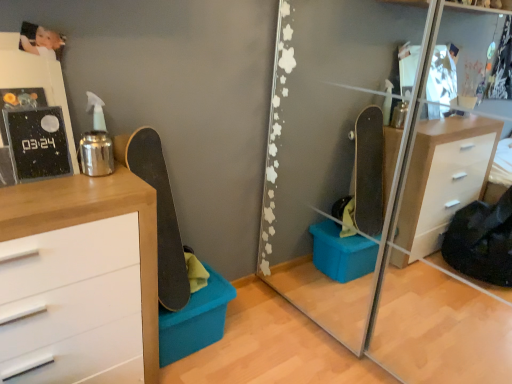
Question: Does smooth black skateboard at left contain matte blue plastic storage box at lower center?

Choices:
 (A) yes
 (B) no

Answer: (B)

Question: Is smooth black skateboard at left taller than matte blue plastic storage box at lower center?

Choices:
 (A) no
 (B) yes

Answer: (B)

Question: Considering the relative positions of smooth black skateboard at left and matte blue plastic storage box at lower center in the image provided, is smooth black skateboard at left in front of matte blue plastic storage box at lower center?

Choices:
 (A) no
 (B) yes

Answer: (B)

Question: Is smooth black skateboard at left at the right side of matte blue plastic storage box at lower center?

Choices:
 (A) yes
 (B) no

Answer: (B)

Question: Is smooth black skateboard at left next to matte blue plastic storage box at lower center?

Choices:
 (A) no
 (B) yes

Answer: (A)

Question: Is matte blue plastic storage box at lower center bigger or smaller than smooth black skateboard at left?

Choices:
 (A) small
 (B) big

Answer: (A)

Question: Do you think matte blue plastic storage box at lower center is within smooth black skateboard at left, or outside of it?

Choices:
 (A) outside
 (B) inside

Answer: (A)

Question: Is matte blue plastic storage box at lower center taller or shorter than smooth black skateboard at left?

Choices:
 (A) short
 (B) tall

Answer: (A)

Question: From the image's perspective, is matte blue plastic storage box at lower center located above or below smooth black skateboard at left?

Choices:
 (A) below
 (B) above

Answer: (A)

Question: From a real-world perspective, is wooden chest of drawers at left physically located above or below white glossy picture frame at upper left?

Choices:
 (A) above
 (B) below

Answer: (B)

Question: Considering their positions, is wooden chest of drawers at left located in front of or behind white glossy picture frame at upper left?

Choices:
 (A) front
 (B) behind

Answer: (A)

Question: Visually, is wooden chest of drawers at left positioned to the left or to the right of white glossy picture frame at upper left?

Choices:
 (A) right
 (B) left

Answer: (A)

Question: From the image's perspective, is wooden chest of drawers at left located above or below white glossy picture frame at upper left?

Choices:
 (A) above
 (B) below

Answer: (B)

Question: From a real-world perspective, is white glossy picture frame at upper left positioned above or below smooth black skateboard at left?

Choices:
 (A) below
 (B) above

Answer: (B)

Question: In terms of size, does white glossy picture frame at upper left appear bigger or smaller than smooth black skateboard at left?

Choices:
 (A) small
 (B) big

Answer: (A)